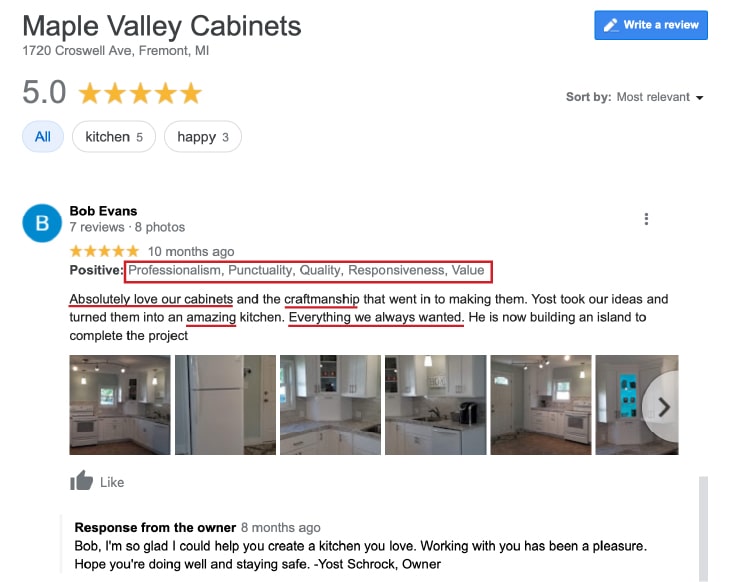
The width and height of the screenshot is (730, 582). Find the location of `door`. door is located at coordinates (502, 395).